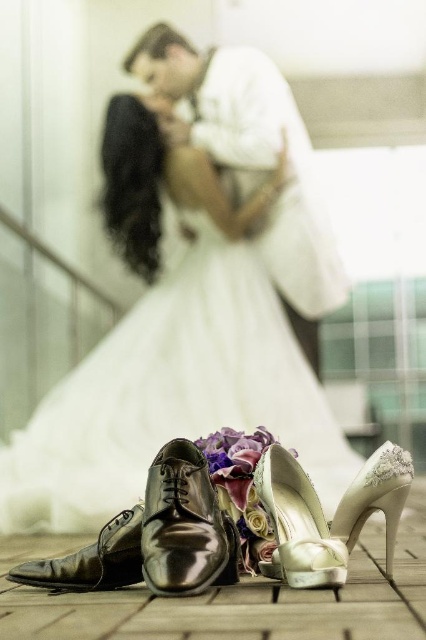
You are a photographer adjusting the camera focus. The ivory satin high heel at center is currently in focus. To ensure the entire bouquet of flowers between the shoes is sharp, where should you adjust the focus point to? Please provide coordinates based on the image plane.

The entire bouquet of flowers between the shoes can be captured sharply by adjusting the focus point to the center of the bouquet, which is located between the ivory satin high heel at center and the other shoes. However, since the exact coordinates of the bouquet aren

You are a photographer standing at the back of the wedding scene. You want to capture a closeup shot of the matte white suit at upper center and the ivory satin high heel at center without moving the camera. Can you fit both subjects in the frame if your camera has a 1.5 meter field of view?

The distance between the matte white suit at upper center and the ivory satin high heel at center is 1.82 meters. Since the camera has a 1.5 meter field of view, which is shorter than the distance between them, you cannot fit both subjects in the frame without moving the camera.